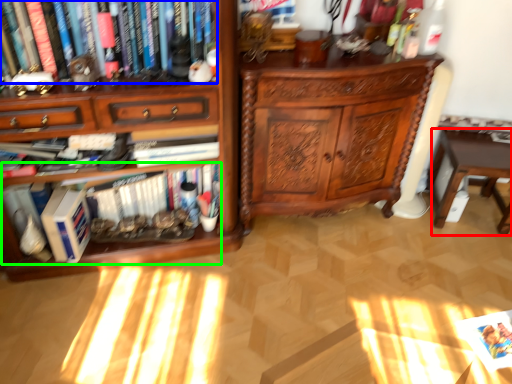
Question: Which object is positioned farthest from table (highlighted by a red box)? Select from book (highlighted by a blue box) and book (highlighted by a green box).

Choices:
 (A) book
 (B) book

Answer: (A)